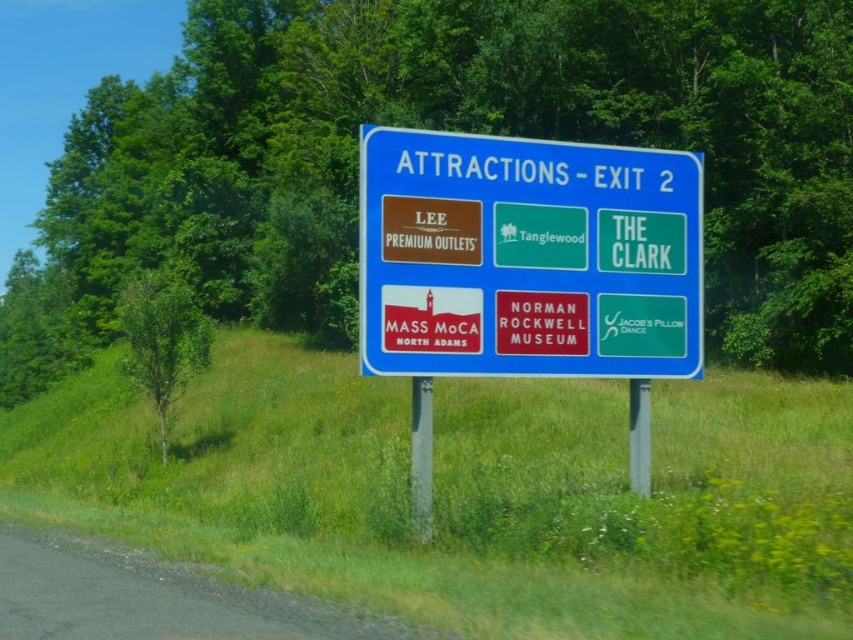
Question: Is blue plastic sign at center thinner than silver metallic pole at center?

Choices:
 (A) no
 (B) yes

Answer: (A)

Question: Which of these objects is positioned farthest from the blue plastic sign at center?

Choices:
 (A) metallic gray pole at center
 (B) silver metallic pole at center

Answer: (A)

Question: In this image, where is silver metallic pole at center located relative to metallic gray pole at center?

Choices:
 (A) below
 (B) above

Answer: (A)

Question: Which point appears closest to the camera in this image?

Choices:
 (A) (462, 141)
 (B) (419, 435)
 (C) (648, 387)

Answer: (A)

Question: Does blue plastic sign at center appear on the right side of metallic gray pole at center?

Choices:
 (A) yes
 (B) no

Answer: (B)

Question: Among these points, which one is farthest from the camera?

Choices:
 (A) 636,412
 (B) 364,140

Answer: (A)